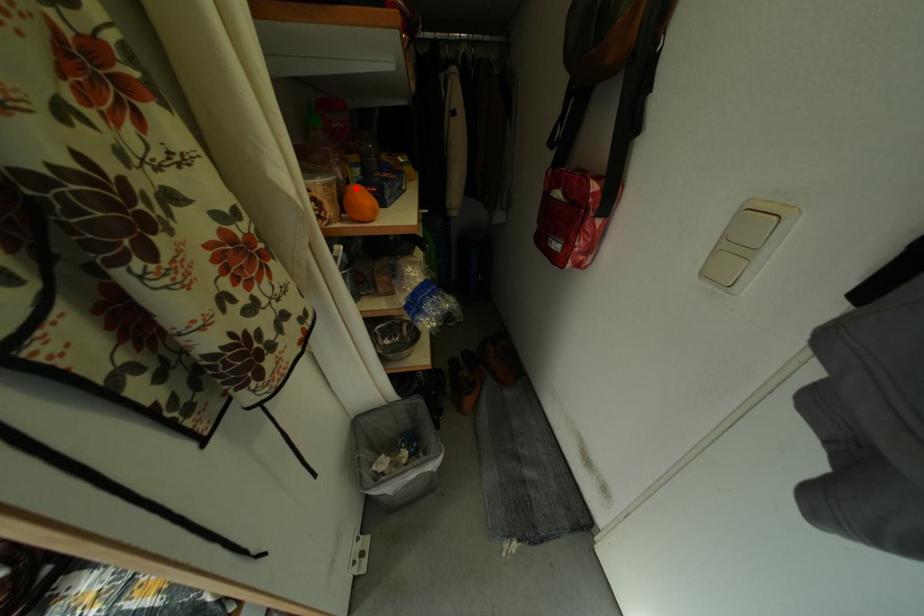
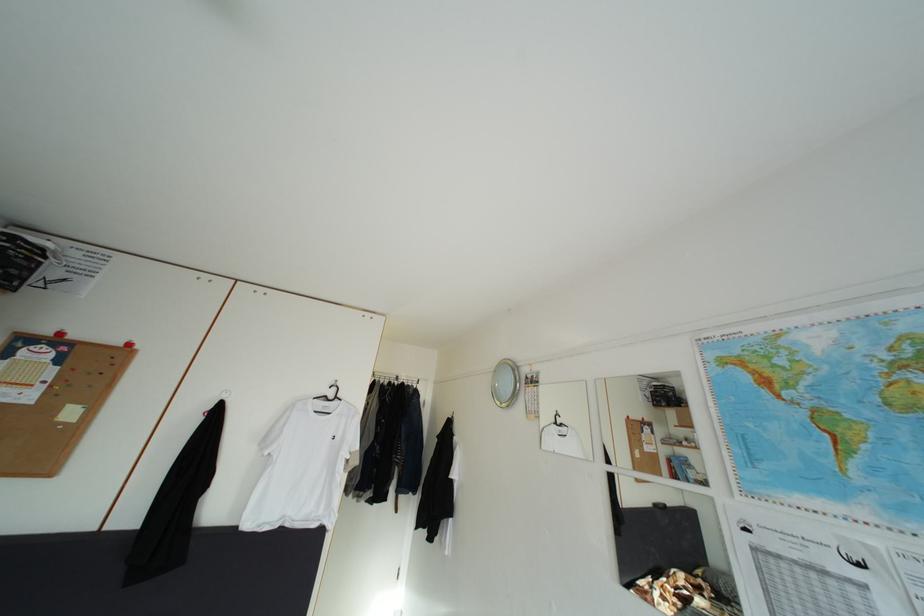
Question: I am providing you with two images of the same scene from different viewpoints. A red point is marked on the first image. At the location where the point appears in image 1, is it still visible in image 2?

Choices:
 (A) Yes
 (B) No

Answer: (B)